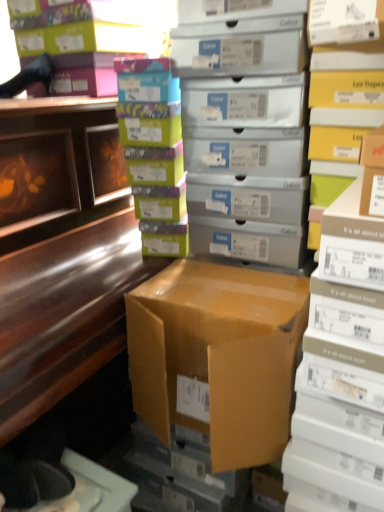
Question: Can you confirm if shiny brown desk at left is taller than matte silver shoebox at center, which appears as the first shelf when viewed from the left?

Choices:
 (A) yes
 (B) no

Answer: (A)

Question: Does shiny brown desk at left have a lesser width compared to matte silver shoebox at center, which appears as the first shelf when viewed from the left?

Choices:
 (A) yes
 (B) no

Answer: (B)

Question: Is shiny brown desk at left positioned with its back to matte silver shoebox at center, positioned as the second shelf in right-to-left order?

Choices:
 (A) no
 (B) yes

Answer: (A)

Question: Can you confirm if shiny brown desk at left is smaller than matte silver shoebox at center, positioned as the second shelf in right-to-left order?

Choices:
 (A) no
 (B) yes

Answer: (A)

Question: Does shiny brown desk at left have a lesser height compared to matte silver shoebox at center, which appears as the first shelf when viewed from the left?

Choices:
 (A) yes
 (B) no

Answer: (B)

Question: Is yellow cardboard box at right, the 2th shelf positioned from the left, bigger or smaller than multicolored cardboard boxes at center, the second book viewed from the right?

Choices:
 (A) small
 (B) big

Answer: (B)

Question: From the image's perspective, is yellow cardboard box at right, the 2th shelf positioned from the left, located above or below multicolored cardboard boxes at center, positioned as the first book in left-to-right order?

Choices:
 (A) below
 (B) above

Answer: (B)

Question: Would you say yellow cardboard box at right, arranged as the first shelf when viewed from the right, is to the left or to the right of multicolored cardboard boxes at center, acting as the first book starting from the top, in the picture?

Choices:
 (A) left
 (B) right

Answer: (B)

Question: Choose the correct answer: Is yellow cardboard box at right, the 2th shelf positioned from the left, inside multicolored cardboard boxes at center, positioned as the first book in left-to-right order, or outside it?

Choices:
 (A) inside
 (B) outside

Answer: (B)

Question: Do you think shiny brown desk at left is within yellow cardboard box at right, arranged as the first shelf when viewed from the right, or outside of it?

Choices:
 (A) inside
 (B) outside

Answer: (B)

Question: From a real-world perspective, is shiny brown desk at left physically located above or below yellow cardboard box at right, arranged as the first shelf when viewed from the right?

Choices:
 (A) below
 (B) above

Answer: (A)

Question: In terms of size, does shiny brown desk at left appear bigger or smaller than yellow cardboard box at right, the 2th shelf positioned from the left?

Choices:
 (A) big
 (B) small

Answer: (A)

Question: Based on their positions, is shiny brown desk at left located to the left or right of yellow cardboard box at right, arranged as the first shelf when viewed from the right?

Choices:
 (A) right
 (B) left

Answer: (B)

Question: From a real-world perspective, is yellow cardboard box at right, the 2th shelf positioned from the left, positioned above or below brown cardboard box at center?

Choices:
 (A) below
 (B) above

Answer: (B)

Question: From their relative heights in the image, would you say yellow cardboard box at right, arranged as the first shelf when viewed from the right, is taller or shorter than brown cardboard box at center?

Choices:
 (A) short
 (B) tall

Answer: (B)